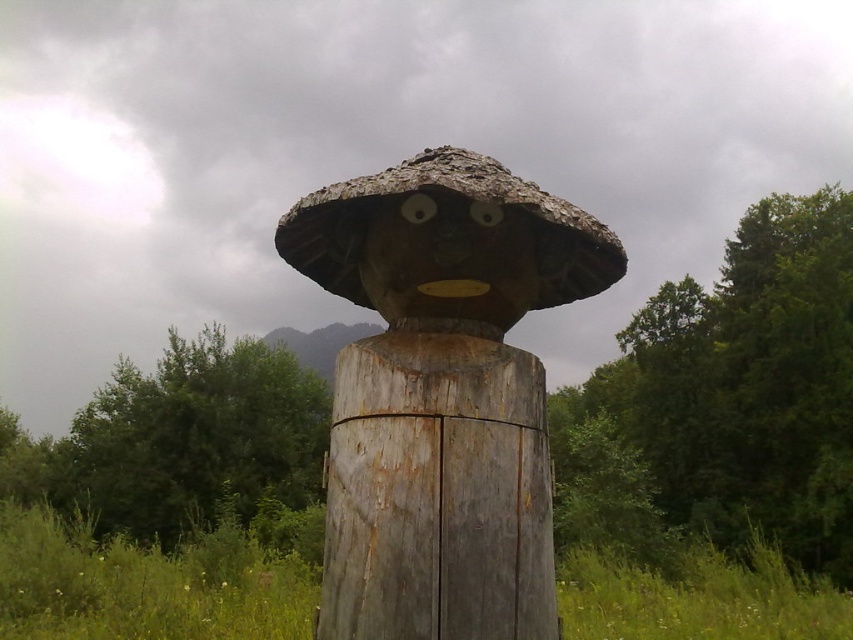
Can you confirm if weathered wood post at center is bigger than wooden sculpture at center?

No.

Based on the photo, between weathered wood post at center and wooden sculpture at center, which one has less height?

With less height is wooden sculpture at center.

Measure the distance between weathered wood post at center and camera.

weathered wood post at center and camera are 6.22 feet apart from each other.

This screenshot has width=853, height=640. In order to click on weathered wood post at center in this screenshot , I will do `click(437, 492)`.

Does rusty wood totem at center have a larger size compared to wooden sculpture at center?

Correct, rusty wood totem at center is larger in size than wooden sculpture at center.

Measure the distance between point [337,493] and camera.

Point [337,493] and camera are 2.20 meters apart.

I want to click on rusty wood totem at center, so click(442, 394).

From the picture: Between rusty wood totem at center and weathered wood post at center, which one appears on the right side from the viewer's perspective?

weathered wood post at center

Is rusty wood totem at center below weathered wood post at center?

Actually, rusty wood totem at center is above weathered wood post at center.

Does point (363, 432) come closer to viewer compared to point (387, 442)?

No, it is not.

Identify the location of rusty wood totem at center. (442, 394).